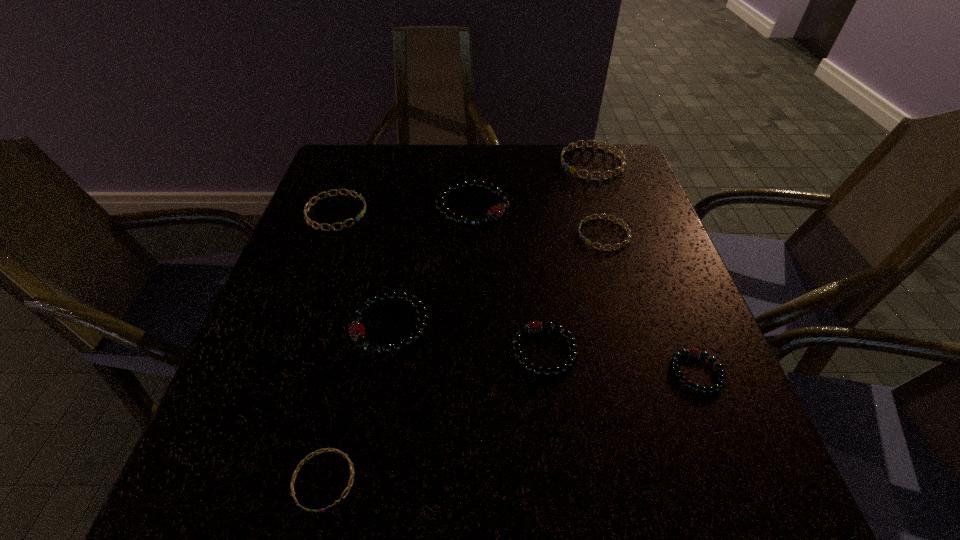
This screenshot has width=960, height=540. Find the location of `object that is the fourth closest to the tallest bracelet`. object that is the fourth closest to the tallest bracelet is located at coordinates (356, 329).

I want to click on the fourth closest object relative to the second biggest blue bracelet, so click(x=588, y=242).

Select which bracelet is the second closest to the second smallest blue bracelet. Please provide its 2D coordinates. Your answer should be formatted as a tuple, i.e. [(x, y)], where the tuple contains the x and y coordinates of a point satisfying the conditions above.

[(495, 212)]

At what (x,y) coordinates should I click in order to perform the action: click on bracelet that is the seventh nearest to the second smallest black bracelet. Please return your answer as a coordinate pair (x, y). This screenshot has width=960, height=540. Looking at the image, I should click on (622, 157).

Where is `black bracelet that stands as the closest to the nearest blue bracelet`? Image resolution: width=960 pixels, height=540 pixels. black bracelet that stands as the closest to the nearest blue bracelet is located at coordinates (356, 329).

Identify which black bracelet is the third closest to the second biggest black bracelet. Please provide its 2D coordinates. Your answer should be formatted as a tuple, i.e. [(x, y)], where the tuple contains the x and y coordinates of a point satisfying the conditions above.

[(694, 353)]

Identify the location of the third closest blue bracelet to the farthest object. This screenshot has height=540, width=960. (298, 468).

Find the location of a particular element. Image resolution: width=960 pixels, height=540 pixels. blue bracelet that stands as the fourth closest to the tallest bracelet is located at coordinates (298, 468).

Where is `vacant space that satisfies the following two spatial constraints: 1. on the surface of the third biggest blue bracelet showing star-shaped elements; 2. on the front side of the second smallest black bracelet`? The width and height of the screenshot is (960, 540). vacant space that satisfies the following two spatial constraints: 1. on the surface of the third biggest blue bracelet showing star-shaped elements; 2. on the front side of the second smallest black bracelet is located at coordinates (638, 351).

The width and height of the screenshot is (960, 540). In order to click on vacant area that satisfies the following two spatial constraints: 1. on the back side of the rightmost black bracelet; 2. on the surface of the leftmost blue bracelet showing star-shaped elements in this screenshot , I will do `click(634, 213)`.